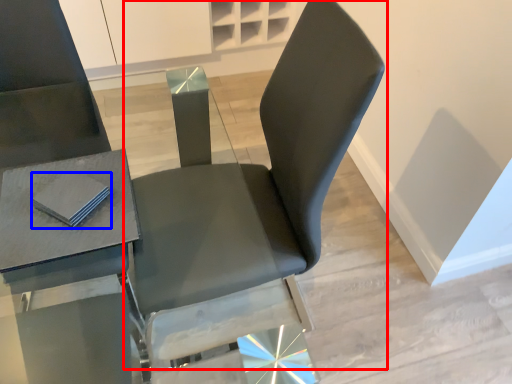
Question: Which of the following is the closest to the observer, chair (highlighted by a red box) or pad (highlighted by a blue box)?

Choices:
 (A) chair
 (B) pad

Answer: (A)